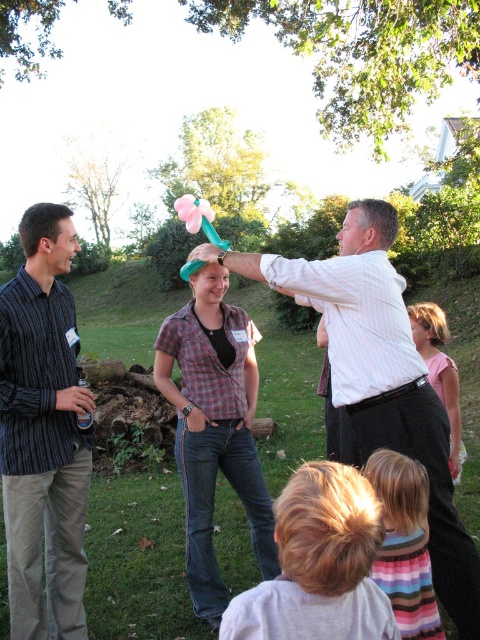
Question: Among these points, which one is farthest from the camera?

Choices:
 (A) (193, 214)
 (B) (10, 604)
 (C) (397, 426)
 (D) (252, 456)

Answer: (D)

Question: Is white striped shirt at center below pink fabric dress at lower right?

Choices:
 (A) no
 (B) yes

Answer: (B)

Question: Among these points, which one is farthest from the camera?

Choices:
 (A) (38, 378)
 (B) (437, 390)
 (C) (190, 211)

Answer: (B)

Question: Which is nearer to the plaid shirt at center?

Choices:
 (A) striped cotton shirt at left
 (B) pink fabric dress at lower right

Answer: (A)

Question: Does white striped shirt at center appear on the right side of pink fabric dress at lower right?

Choices:
 (A) no
 (B) yes

Answer: (A)

Question: Can you confirm if white striped shirt at center is smaller than cotton candy at center?

Choices:
 (A) no
 (B) yes

Answer: (B)